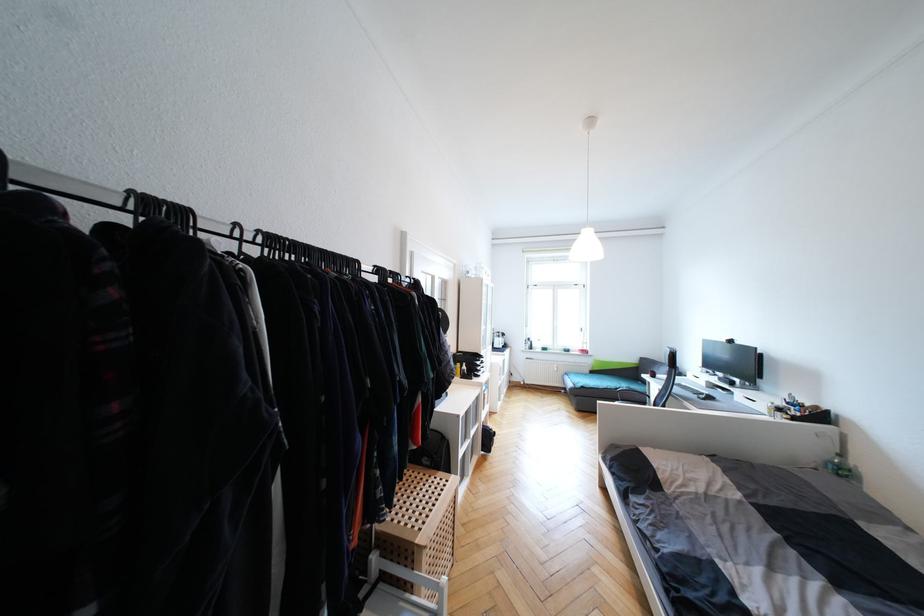
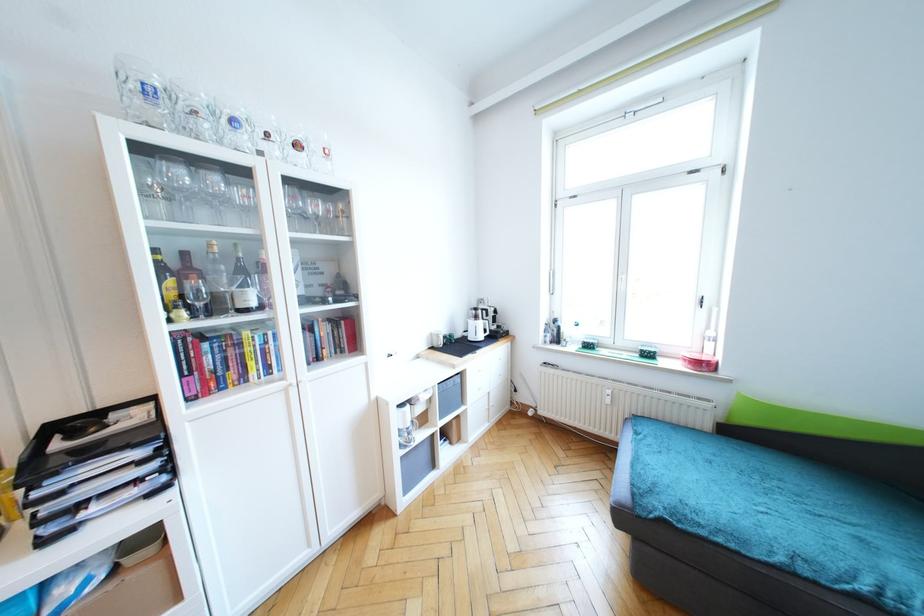
The images are taken continuously from a first-person perspective. In which direction are you moving?

The cameraman moved toward right, forward.